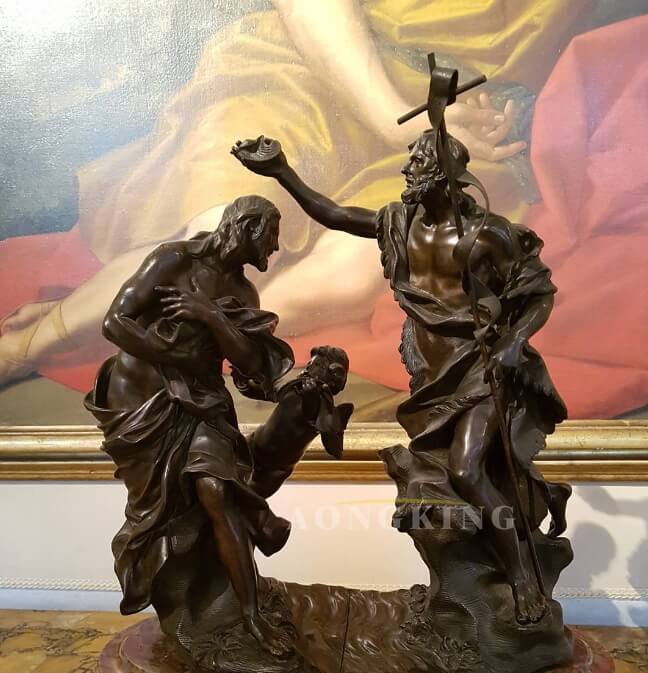
The width and height of the screenshot is (648, 673). I want to click on statue base, so click(350, 647).